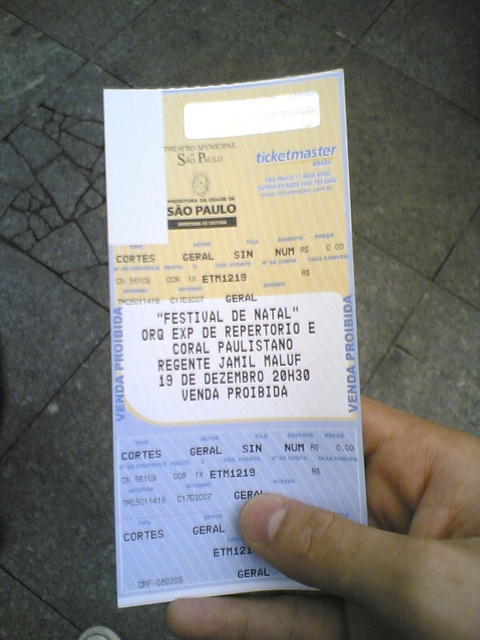
Question: In this image, where is white paper ticket at center located relative to skinny white hand at lower right?

Choices:
 (A) right
 (B) left

Answer: (B)

Question: Among these objects, which one is farthest from the camera?

Choices:
 (A) skinny white hand at lower right
 (B) white paper ticket at center

Answer: (B)

Question: Is white paper ticket at center to the right of skinny white hand at lower right from the viewer's perspective?

Choices:
 (A) yes
 (B) no

Answer: (B)

Question: Can you confirm if white paper ticket at center is thinner than skinny white hand at lower right?

Choices:
 (A) no
 (B) yes

Answer: (B)